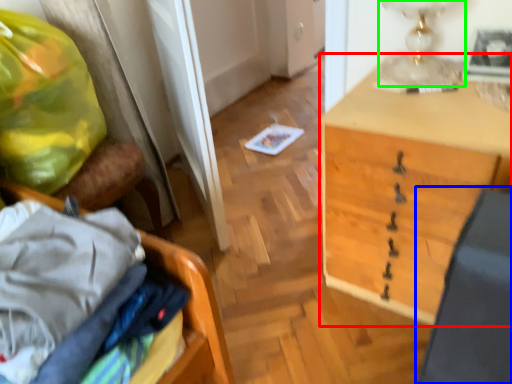
Question: Based on their relative distances, which object is farther from desk (highlighted by a red box)? Choose from swivel chair (highlighted by a blue box) and table lamp (highlighted by a green box).

Choices:
 (A) swivel chair
 (B) table lamp

Answer: (A)